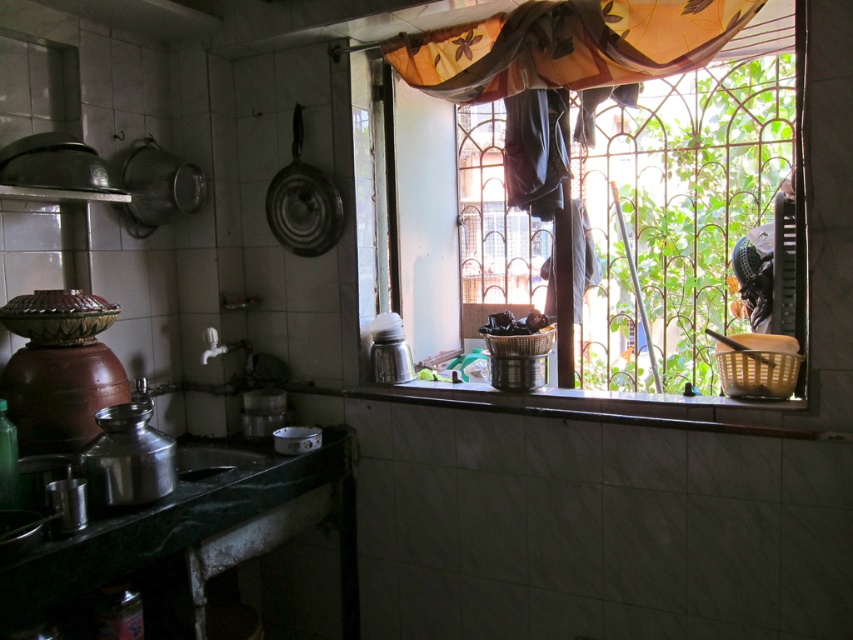
You are standing in the kitchen and want to hang a new curtain. The translucent fabric at upper right is currently blocking the view. Can you move the metallic sink at lower left to the right to make space for the new curtain?

The translucent fabric at upper right is already positioned to the right of the metallic sink at lower left, so moving the sink to the right would place it further away from the fabric, potentially creating more space. However, the metallic sink at lower left is likely fixed in place and cannot be moved.

You are standing in the kitchen and want to reach the point marked as point (436, 45). If you can move forward 5 feet, will you be able to reach it?

The distance between you and point (436, 45) is 7.37 feet. Since you can move forward only 5 feet, you won not be able to reach it.